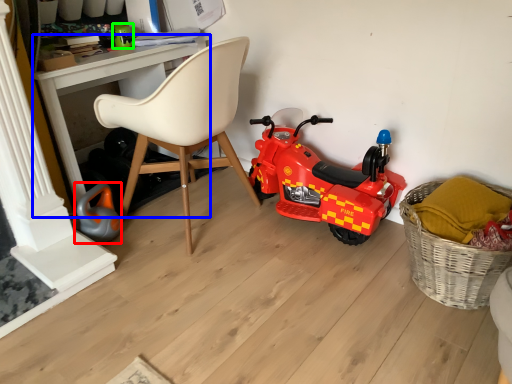
Question: Considering the real-world distances, which object is farthest from toy (highlighted by a red box)? desk (highlighted by a blue box) or toy (highlighted by a green box)?

Choices:
 (A) desk
 (B) toy

Answer: (B)